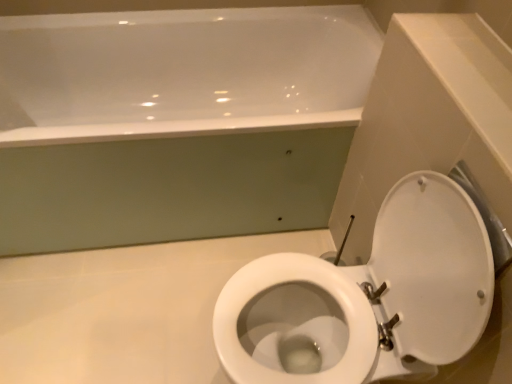
Question: From a real-world perspective, is white glossy bathtub at upper center positioned above or below white glossy toilet at lower right?

Choices:
 (A) below
 (B) above

Answer: (A)

Question: Is point (104, 200) positioned closer to the camera than point (274, 342)?

Choices:
 (A) farther
 (B) closer

Answer: (A)

Question: Is white glossy bathtub at upper center to the left or to the right of white glossy toilet at lower right in the image?

Choices:
 (A) right
 (B) left

Answer: (B)

Question: Considering the positions of white glossy toilet at lower right and white glossy bathtub at upper center in the image, is white glossy toilet at lower right wider or thinner than white glossy bathtub at upper center?

Choices:
 (A) wide
 (B) thin

Answer: (B)

Question: From a real-world perspective, relative to white glossy bathtub at upper center, is white glossy toilet at lower right vertically above or below?

Choices:
 (A) above
 (B) below

Answer: (A)

Question: Based on their sizes in the image, would you say white glossy toilet at lower right is bigger or smaller than white glossy bathtub at upper center?

Choices:
 (A) big
 (B) small

Answer: (B)

Question: Considering the relative positions of white glossy toilet at lower right and white glossy bathtub at upper center in the image provided, is white glossy toilet at lower right to the left or to the right of white glossy bathtub at upper center?

Choices:
 (A) right
 (B) left

Answer: (A)